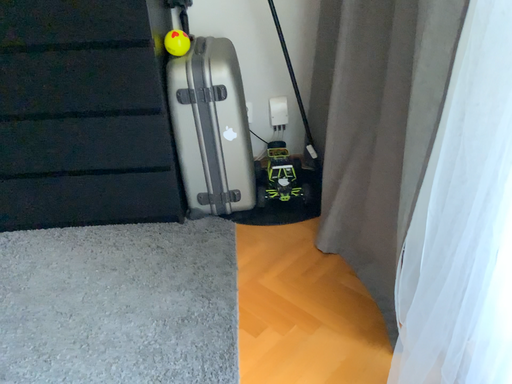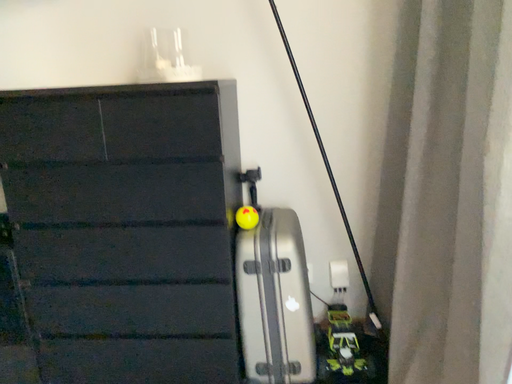
Question: How did the camera likely rotate when shooting the video?

Choices:
 (A) rotated downward
 (B) rotated upward

Answer: (B)